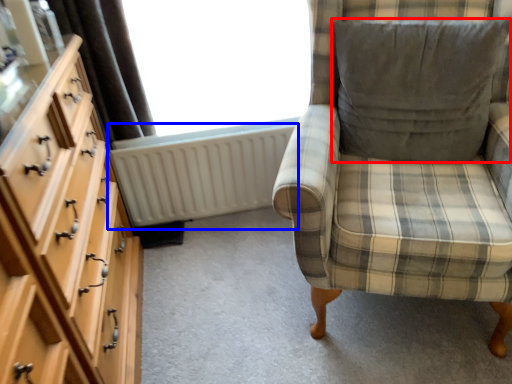
Question: Which object is further to the camera taking this photo, pillow (highlighted by a red box) or radiator (highlighted by a blue box)?

Choices:
 (A) pillow
 (B) radiator

Answer: (B)